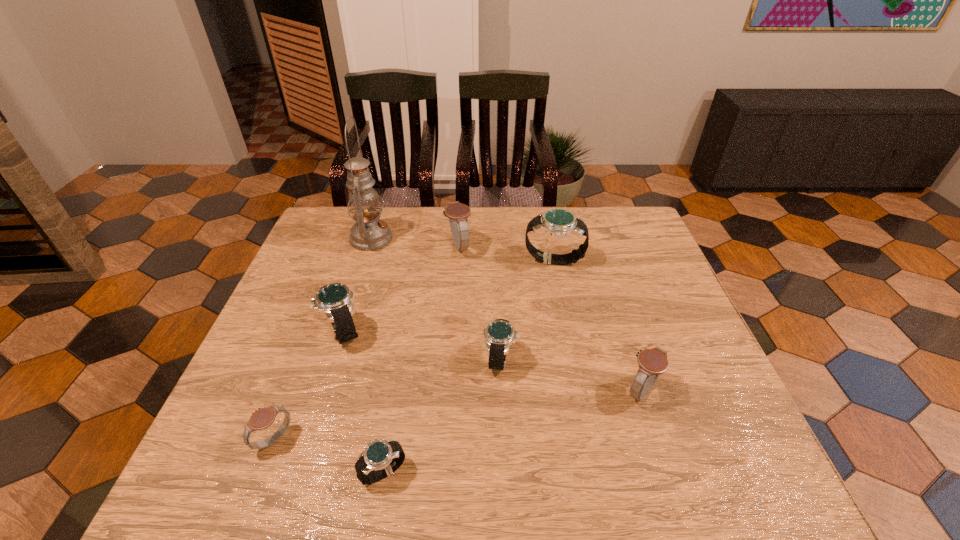
Where is `the sixth object from left to right`? Image resolution: width=960 pixels, height=540 pixels. the sixth object from left to right is located at coordinates (499, 334).

This screenshot has width=960, height=540. Find the location of `the smallest gray watch`. the smallest gray watch is located at coordinates (262, 418).

The height and width of the screenshot is (540, 960). I want to click on the nearest gray watch, so click(262, 418).

This screenshot has height=540, width=960. Identify the location of the second silver watch from left to right. (385, 457).

Where is `the nearest silver watch`? the nearest silver watch is located at coordinates (385, 457).

Where is `vacant space located 0.110m on the left of the tallest object`? vacant space located 0.110m on the left of the tallest object is located at coordinates (315, 238).

The height and width of the screenshot is (540, 960). Find the location of `free location located 0.310m on the front of the biggest silver watch`. free location located 0.310m on the front of the biggest silver watch is located at coordinates (574, 361).

What are the coordinates of `vacant point located on the right of the fourth watch from right to left` in the screenshot? It's located at (576, 246).

The image size is (960, 540). In order to click on vacant area situated 0.350m on the right of the second biggest silver watch in this screenshot , I will do `click(506, 331)`.

This screenshot has width=960, height=540. Identify the location of free region located 0.080m on the front of the second farthest gray watch. (660, 447).